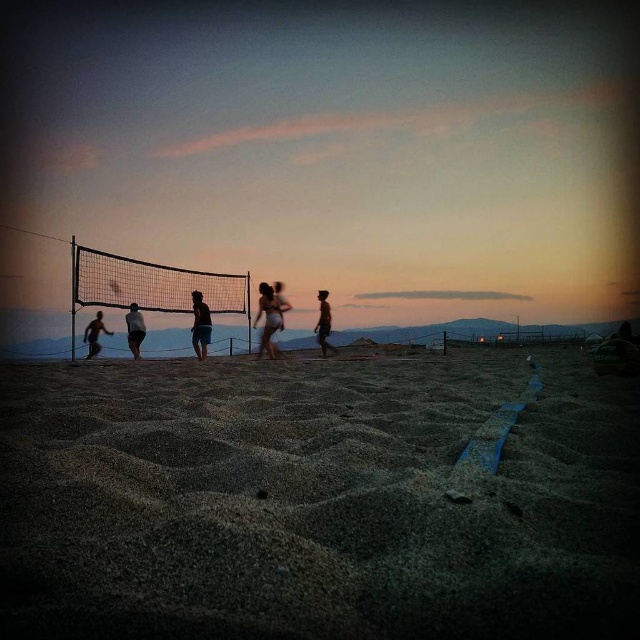
Can you confirm if dark blue shorts at center is shorter than silhouette sand volleyball player at center?

No.

Between dark blue shorts at center and silhouette sand volleyball player at center, which one is positioned lower?

dark blue shorts at center is below.

Find the location of a particular element. This screenshot has width=640, height=640. dark blue shorts at center is located at coordinates (200, 324).

Who is positioned more to the left, dark brown sand at lower center or dark silhouette person at left?

Positioned to the left is dark silhouette person at left.

The height and width of the screenshot is (640, 640). Find the location of `dark brown sand at lower center`. dark brown sand at lower center is located at coordinates (316, 500).

Who is more distant from viewer, [321,340] or [134,356]?

Point [134,356]

Which is behind, point (323, 337) or point (131, 321)?

Positioned behind is point (131, 321).

I want to click on silhouette figure at center, so click(323, 323).